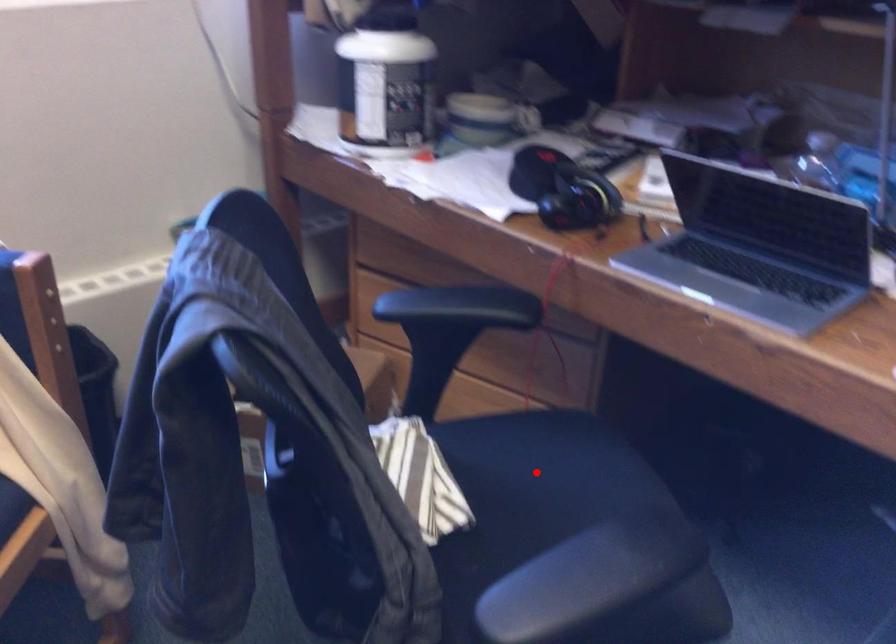
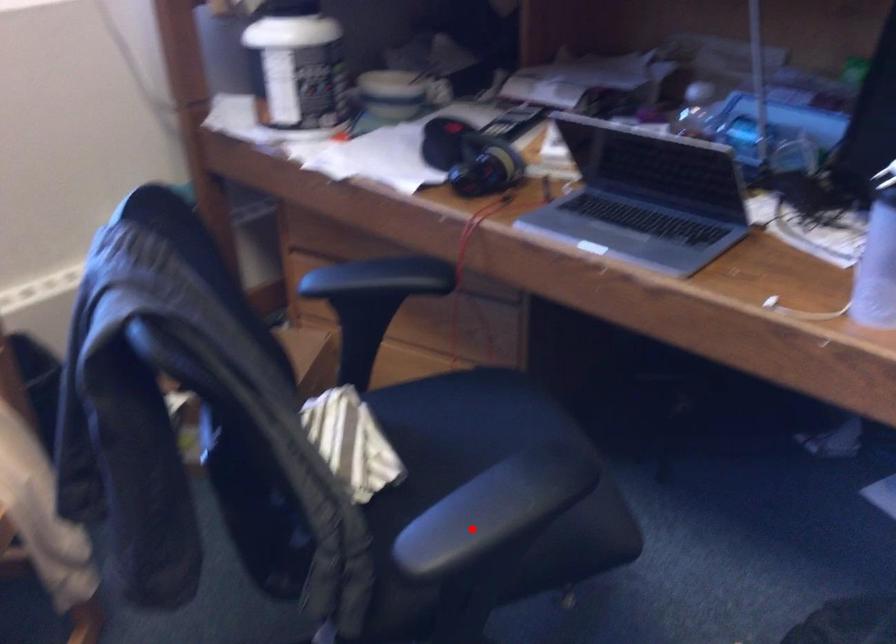
I am providing you with two images of the same scene from different viewpoints. A red point is marked on the first image and another point is marked on the second image. Does the point marked in image1 correspond to the same location as the one in image2?

No